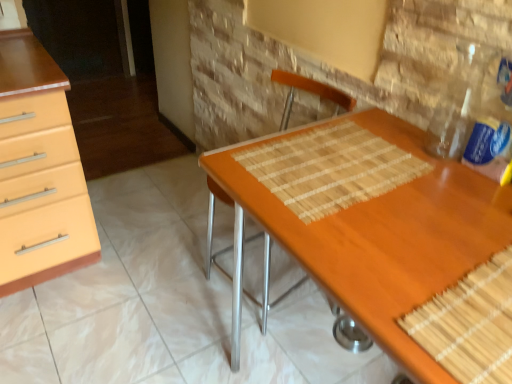
Find the location of a particular element. This screenshot has height=384, width=512. free location in front of bamboo placemat at center is located at coordinates (373, 241).